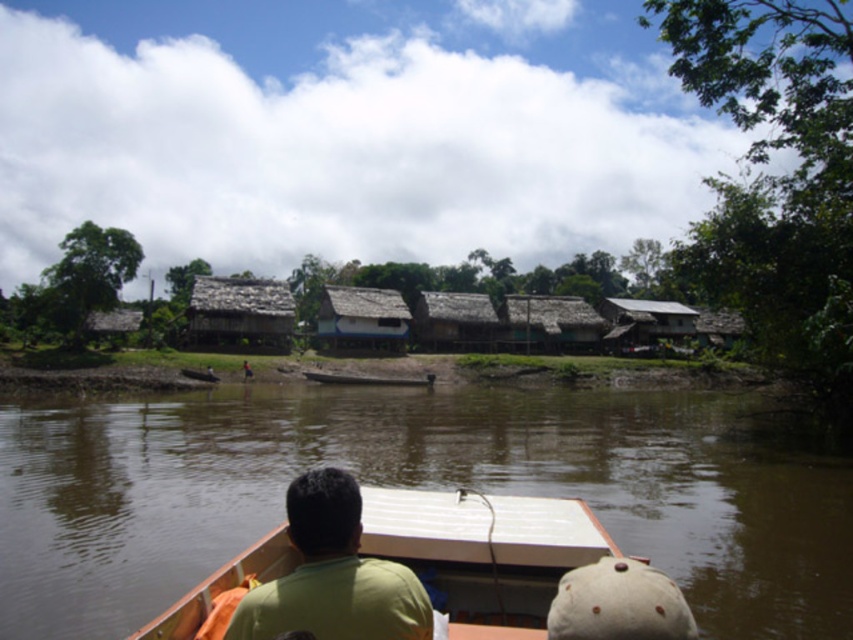
Question: Can you confirm if thatched wood hut at center is positioned above brown wooden hut at center?

Choices:
 (A) no
 (B) yes

Answer: (B)

Question: Which object is the closest to the white matte boat at center?

Choices:
 (A) thatched roof hut at center
 (B) brown muddy water at center

Answer: (B)

Question: Which point is closer to the camera?

Choices:
 (A) (785, 612)
 (B) (122, 328)

Answer: (A)

Question: Considering the real-world distances, which object is closest to the rustic wooden hut at right?

Choices:
 (A) rustic wooden hut at center
 (B) thatched wood hut at center
 (C) green matte shirt at lower center

Answer: (A)

Question: Considering the relative positions of brown muddy water at center and thatched roof hut at left in the image provided, where is brown muddy water at center located with respect to thatched roof hut at left?

Choices:
 (A) above
 (B) below

Answer: (B)

Question: Does brown wooden hut at center have a smaller size compared to rustic wooden hut at center?

Choices:
 (A) no
 (B) yes

Answer: (B)